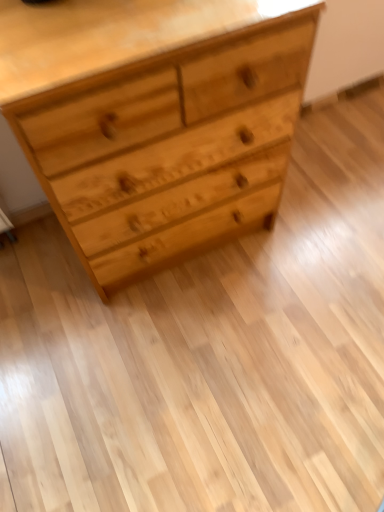
Question: Does natural wood chest of drawers at upper center appear on the left side of natural wood drawer at center?

Choices:
 (A) no
 (B) yes

Answer: (B)

Question: Would you say natural wood chest of drawers at upper center is outside natural wood drawer at center?

Choices:
 (A) no
 (B) yes

Answer: (B)

Question: Is natural wood chest of drawers at upper center facing towards natural wood drawer at center?

Choices:
 (A) no
 (B) yes

Answer: (A)

Question: From a real-world perspective, is natural wood chest of drawers at upper center positioned over natural wood drawer at center based on gravity?

Choices:
 (A) yes
 (B) no

Answer: (A)

Question: Are natural wood chest of drawers at upper center and natural wood drawer at center located far from each other?

Choices:
 (A) yes
 (B) no

Answer: (B)

Question: Is natural wood chest of drawers at upper center turned away from natural wood drawer at center?

Choices:
 (A) yes
 (B) no

Answer: (A)

Question: Does natural wood drawer at center have a greater height compared to natural wood chest of drawers at upper center?

Choices:
 (A) no
 (B) yes

Answer: (A)

Question: From the image's perspective, is natural wood drawer at center on top of natural wood chest of drawers at upper center?

Choices:
 (A) no
 (B) yes

Answer: (B)

Question: Could you tell me if natural wood drawer at center is facing natural wood chest of drawers at upper center?

Choices:
 (A) no
 (B) yes

Answer: (B)

Question: Are natural wood drawer at center and natural wood chest of drawers at upper center beside each other?

Choices:
 (A) yes
 (B) no

Answer: (A)

Question: Can you confirm if natural wood drawer at center is wider than natural wood chest of drawers at upper center?

Choices:
 (A) yes
 (B) no

Answer: (B)

Question: Is natural wood drawer at center outside natural wood chest of drawers at upper center?

Choices:
 (A) no
 (B) yes

Answer: (A)

Question: Is natural wood chest of drawers at upper center in front of or behind natural wood drawer at center in the image?

Choices:
 (A) behind
 (B) front

Answer: (B)